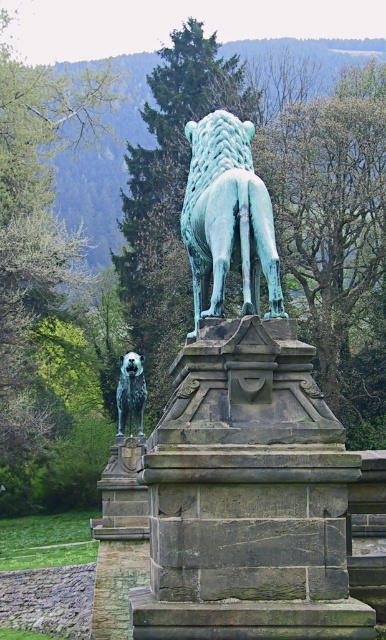
Is the position of green patina lion at center more distant than that of shaggy fur dog at center?

No.

Is green patina lion at center bigger than shaggy fur dog at center?

Yes, green patina lion at center is bigger than shaggy fur dog at center.

What do you see at coordinates (228, 218) in the screenshot? The image size is (386, 640). I see `green patina lion at center` at bounding box center [228, 218].

You are a GUI agent. You are given a task and a screenshot of the screen. Output one action in this format:
    pyautogui.click(x=<x>, y=<y>)
    Task: Click on the green patina lion at center
    Image resolution: width=386 pixels, height=640 pixels.
    Given the screenshot: What is the action you would take?
    pyautogui.click(x=228, y=218)

Does point (336, 436) come behind point (198, 202)?

That is False.

From the picture: Who is more forward, (206, 497) or (269, 262)?

Point (206, 497) is in front.

Find the location of a particular element. The height and width of the screenshot is (640, 386). green patina stone lion at center is located at coordinates (233, 445).

Where is `green patina stone lion at center`? green patina stone lion at center is located at coordinates (x=233, y=445).

Is green patina stone lion at center bigger than shaggy fur dog at center?

Yes, green patina stone lion at center is bigger than shaggy fur dog at center.

Who is positioned more to the left, green patina stone lion at center or shaggy fur dog at center?

Positioned to the left is shaggy fur dog at center.

Is point (215, 291) positioned before point (125, 400)?

Yes, it is.

Find the location of `green patina stone lion at center`. green patina stone lion at center is located at coordinates (233, 445).